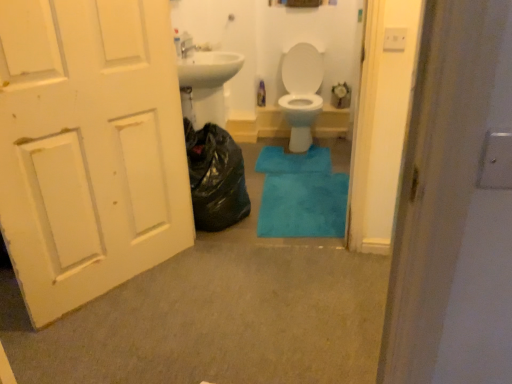
The height and width of the screenshot is (384, 512). What are the coordinates of `vacant region in front of white painted wood door at left` in the screenshot? It's located at (125, 329).